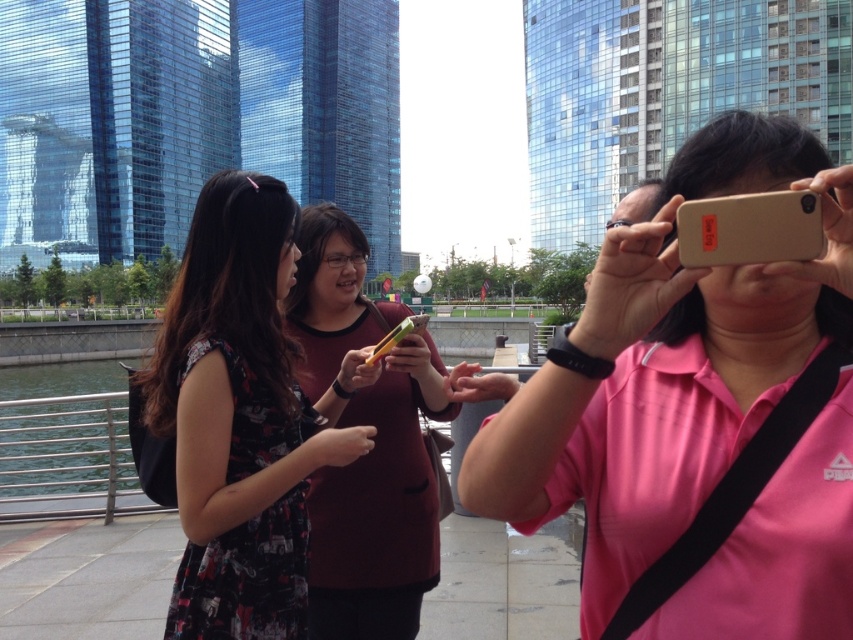
Question: Which point is closer to the camera taking this photo?

Choices:
 (A) coord(218,497)
 (B) coord(653,518)

Answer: (B)

Question: Does matte gold phone at center have a smaller size compared to maroon fabric shirt at center?

Choices:
 (A) no
 (B) yes

Answer: (A)

Question: Is matte gold phone at center closer to the viewer compared to maroon fabric shirt at center?

Choices:
 (A) no
 (B) yes

Answer: (B)

Question: Observing the image, what is the correct spatial positioning of floral dress at center in reference to maroon fabric shirt at center?

Choices:
 (A) below
 (B) above

Answer: (A)

Question: Which object is farther from the camera taking this photo?

Choices:
 (A) floral dress at center
 (B) maroon fabric shirt at center

Answer: (B)

Question: Among these points, which one is nearest to the camera?

Choices:
 (A) (212, 266)
 (B) (338, 248)
 (C) (697, 323)

Answer: (C)